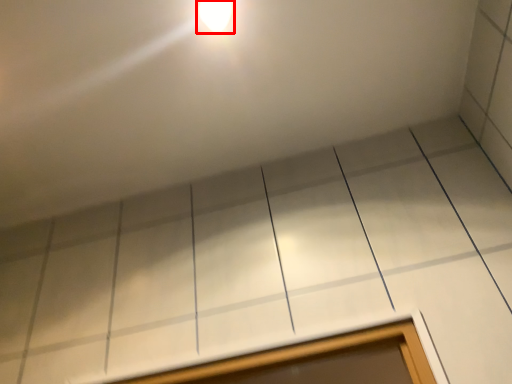
Question: In this image, where is light fixture (annotated by the red box) located relative to window?

Choices:
 (A) left
 (B) right

Answer: (A)